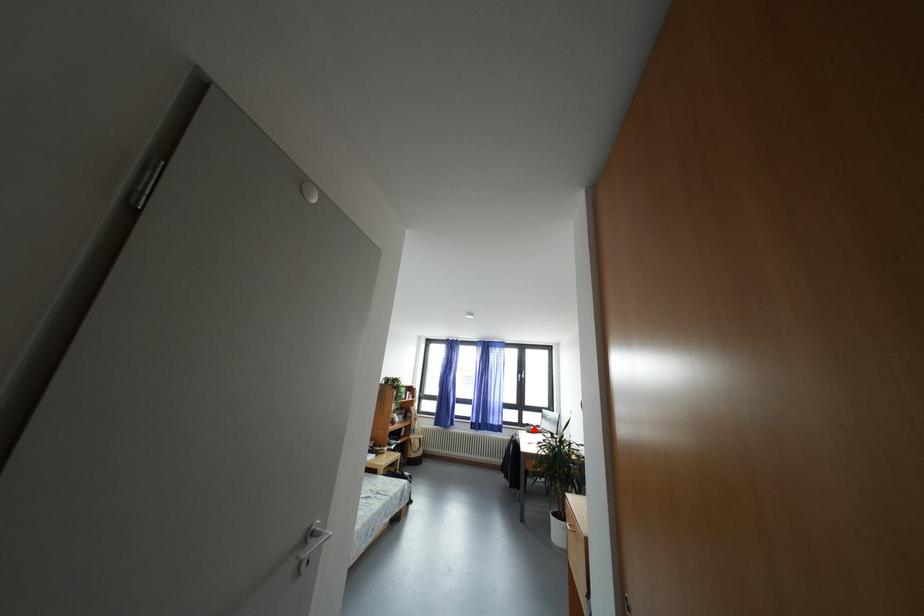
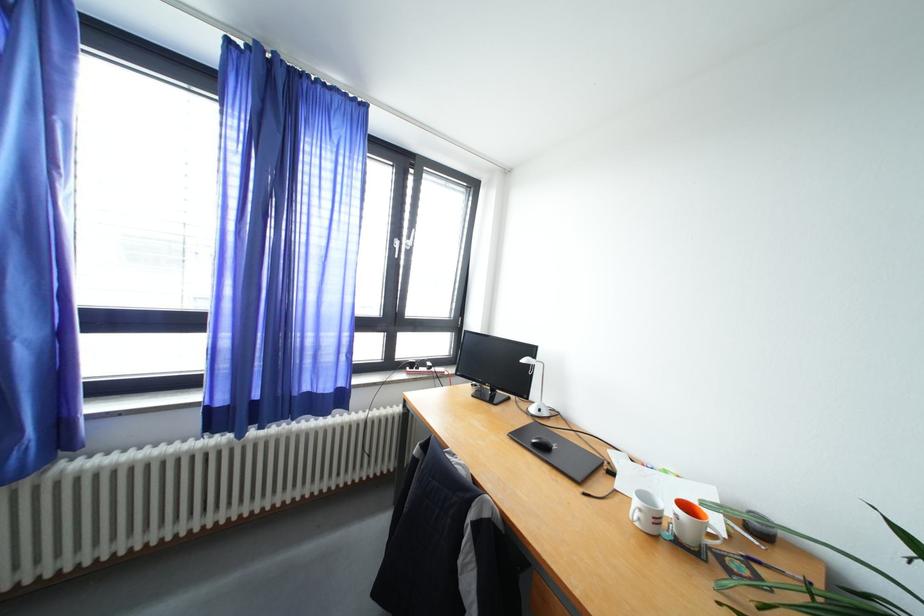
Find the pixel in the second image that matches the highlighted location in the first image.

(419, 370)